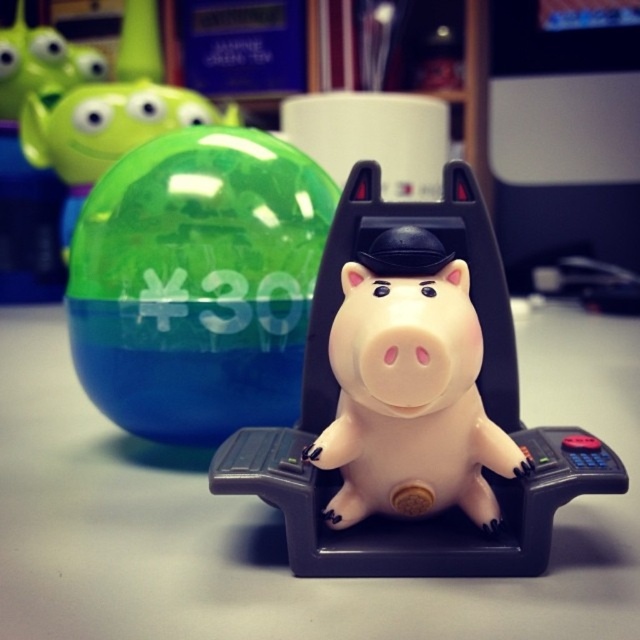
Question: Estimate the real-world distances between objects in this image. Which object is closer to the rubber piggy bank at center?

Choices:
 (A) green glossy ball at upper left
 (B) transparent plastic ball at upper left
 (C) satin pink piggy bank at center

Answer: (C)

Question: Which object appears farthest from the camera in this image?

Choices:
 (A) green glossy ball at upper left
 (B) transparent plastic ball at upper left
 (C) satin pink piggy bank at center

Answer: (A)

Question: Is rubber piggy bank at center closer to camera compared to satin pink piggy bank at center?

Choices:
 (A) no
 (B) yes

Answer: (A)

Question: Which point is farther to the camera?

Choices:
 (A) rubber piggy bank at center
 (B) transparent plastic ball at upper left

Answer: (B)

Question: Does rubber piggy bank at center have a larger size compared to green glossy ball at upper left?

Choices:
 (A) no
 (B) yes

Answer: (A)

Question: Where is satin pink piggy bank at center located in relation to green glossy ball at upper left in the image?

Choices:
 (A) right
 (B) left

Answer: (A)